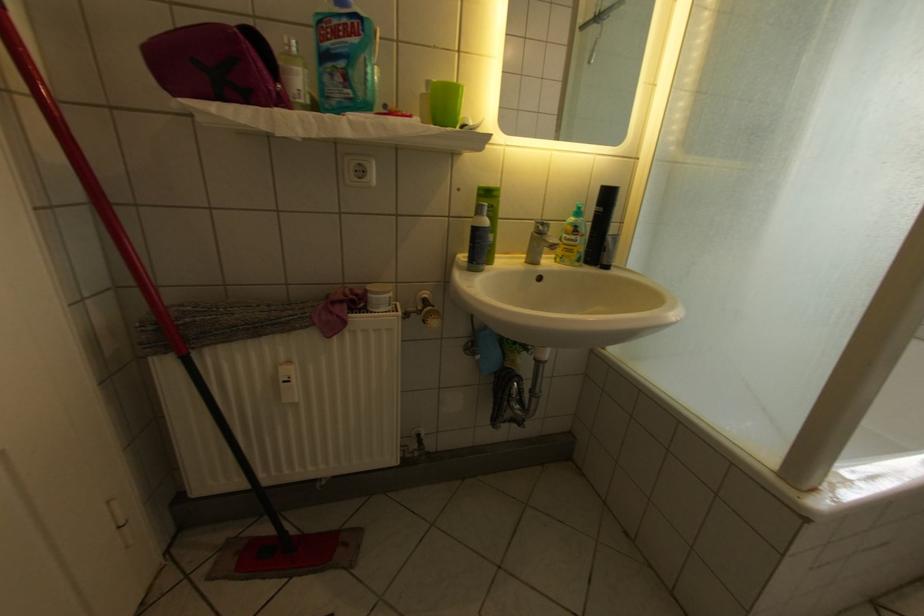
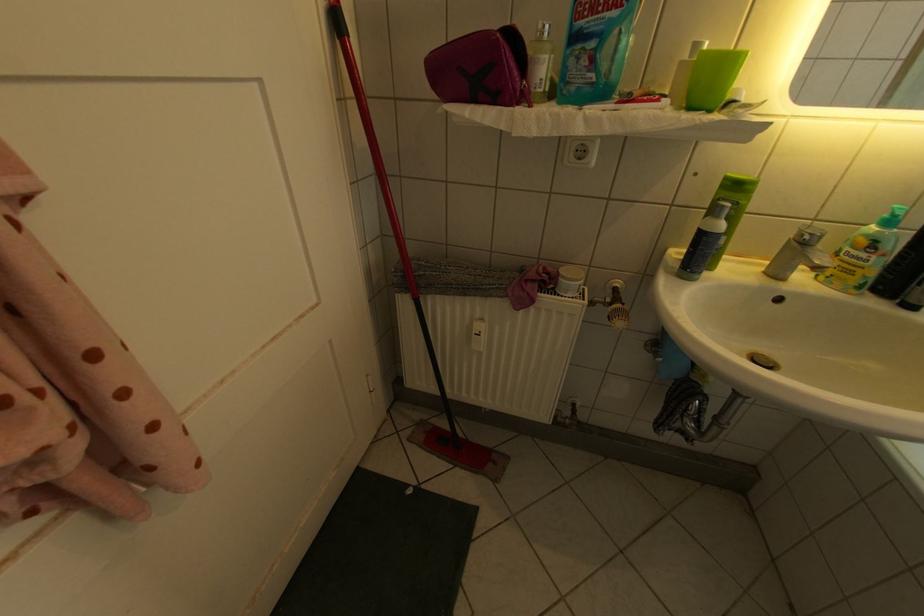
The point at (536, 262) is marked in the first image. Where is the corresponding point in the second image?

(774, 270)